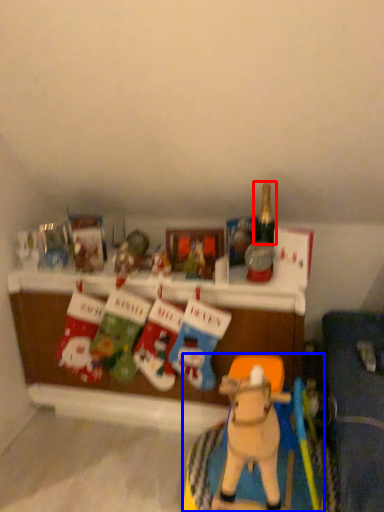
Question: Among these objects, which one is farthest to the camera, bottle (highlighted by a red box) or toy (highlighted by a blue box)?

Choices:
 (A) bottle
 (B) toy

Answer: (A)